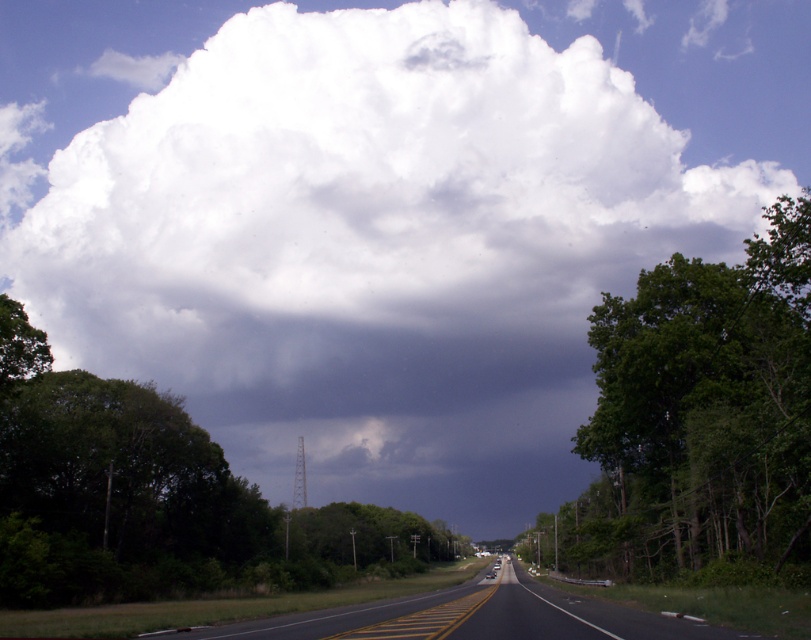
Is point (398, 525) behind point (162, 630)?

Yes, it is behind point (162, 630).

The width and height of the screenshot is (811, 640). What are the coordinates of `green leafy tree at left` in the screenshot? It's located at (153, 499).

Does green leafy tree at right appear on the right side of black asphalt highway at center?

Yes, green leafy tree at right is to the right of black asphalt highway at center.

Measure the distance between green leafy tree at right and black asphalt highway at center.

green leafy tree at right and black asphalt highway at center are 56.27 feet apart from each other.

Is point (787, 342) behind point (492, 593)?

No, it is not.

Where is `green leafy tree at right`? The width and height of the screenshot is (811, 640). green leafy tree at right is located at coordinates (702, 419).

Who is higher up, green leafy tree at right or green leafy tree at left?

green leafy tree at right

Is the position of green leafy tree at right less distant than that of green leafy tree at left?

That is True.

Identify the location of green leafy tree at right. The image size is (811, 640). (702, 419).